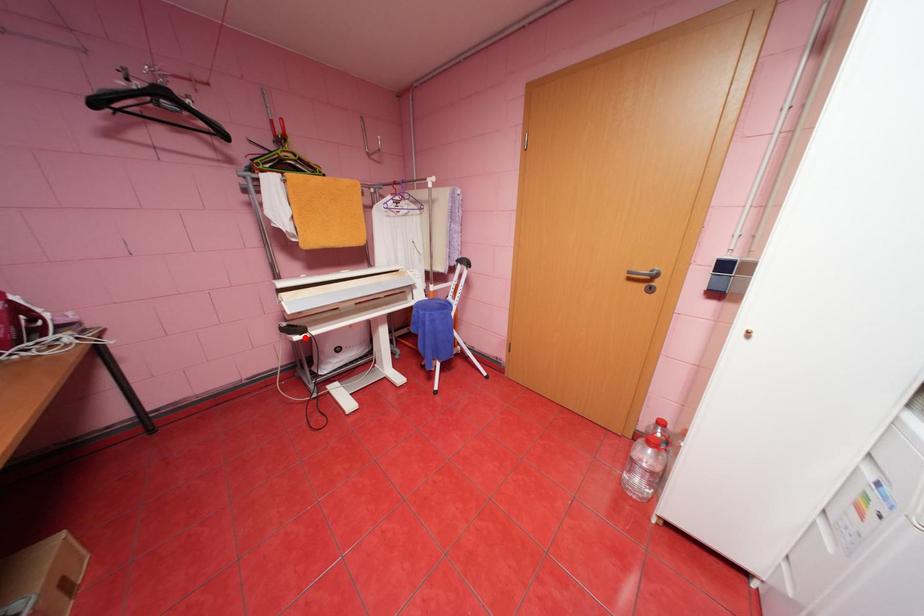
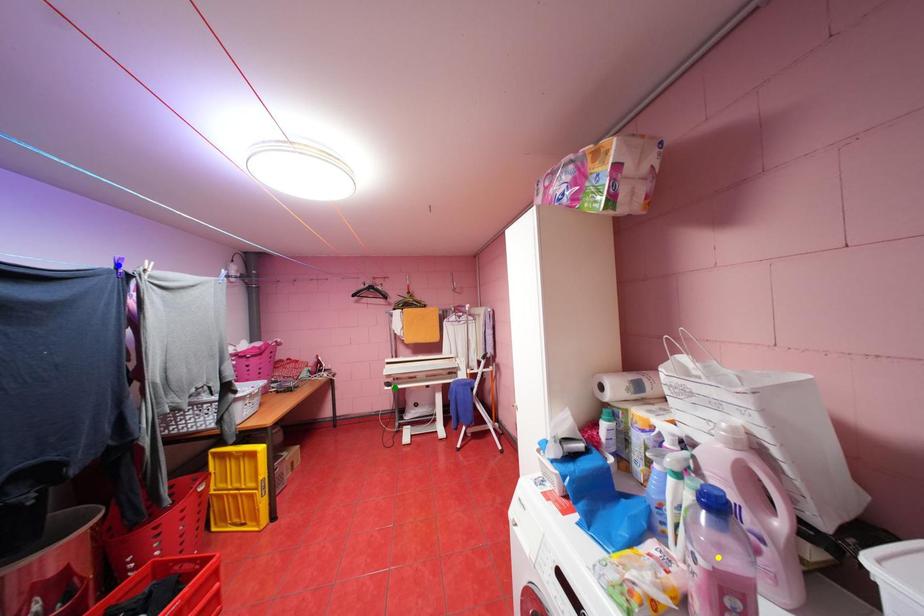
Question: I am providing you with two images of the same scene from different viewpoints. A red point is marked on the first image. You are given multiple points on the second image. In image 2, which mark is for the same physical point as the one in image 1?

Choices:
 (A) green point
 (B) blue point
 (C) yellow point

Answer: (A)